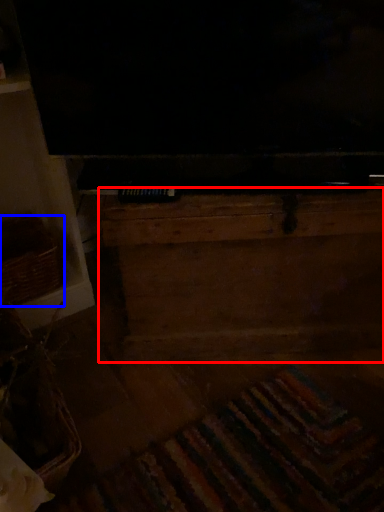
Question: Which object is further to the camera taking this photo, dresser (highlighted by a red box) or basket (highlighted by a blue box)?

Choices:
 (A) dresser
 (B) basket

Answer: (B)